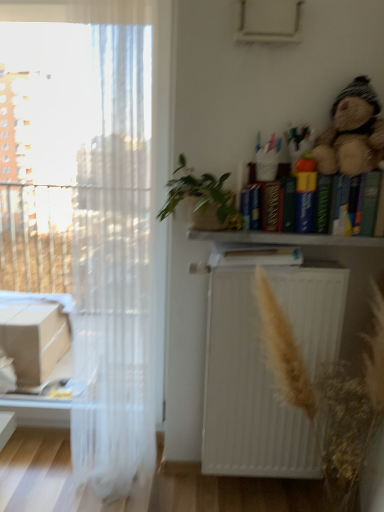
Question: Considering their positions, is fuzzy brown teddy bear at upper right located in front of or behind green woven basket at upper center?

Choices:
 (A) front
 (B) behind

Answer: (A)

Question: Is fuzzy brown teddy bear at upper right bigger or smaller than green woven basket at upper center?

Choices:
 (A) big
 (B) small

Answer: (B)

Question: Estimate the real-world distances between objects in this image. Which object is closer to the hardcover book at center, the 1th book in the left-to-right sequence?

Choices:
 (A) wooden bookshelf at upper right
 (B) white matte radiator at center
 (C) transparent fabric at left
 (D) hardcover book at upper right, the 1th book viewed from the right
 (E) fuzzy brown teddy bear at upper right

Answer: (A)

Question: Considering the real-world distances, which object is farthest from the green woven basket at upper center?

Choices:
 (A) transparent fabric at left
 (B) brown textured plant at center
 (C) fuzzy brown teddy bear at upper right
 (D) wooden bookshelf at upper right
 (E) white matte radiator at center

Answer: (B)